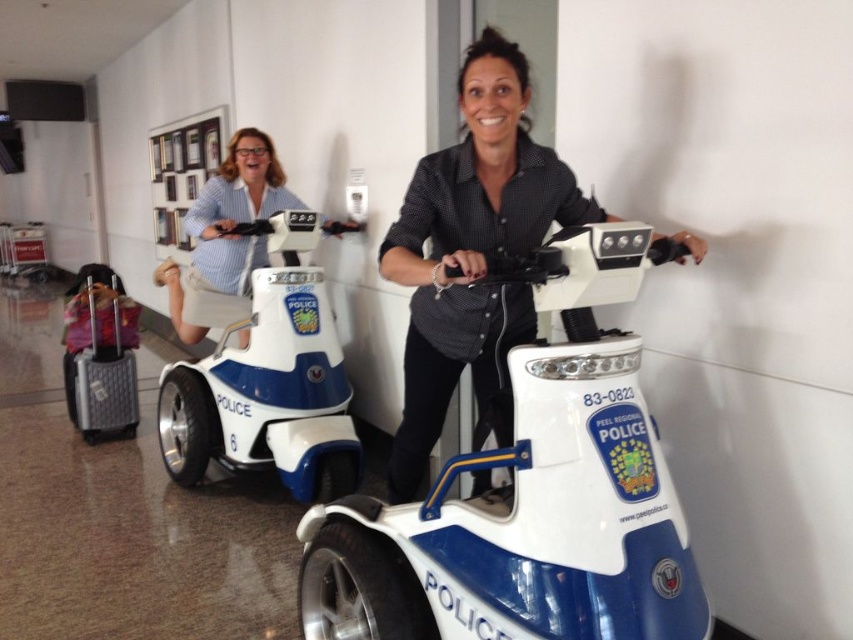
You are a delivery person who needs to move a package from the white plastic mobility scooter at center to the blue glossy police scooter at upper left. The package requires a clear path that is at least 6 feet wide. Can you safely move the package without needing to adjust the scooters?

The distance between the white plastic mobility scooter at center and the blue glossy police scooter at upper left is 6.28 feet, which is wider than the required 6 feet. Therefore, you can safely move the package without adjusting the scooters.

You are navigating a narrow corridor in an airport terminal and need to pass by the white plastic mobility scooter at center. What is the safest path to take around it?

Since the white plastic mobility scooter at center is positioned at coordinates (531,497), you should move around it carefully on either side to ensure safe passage without obstruction.